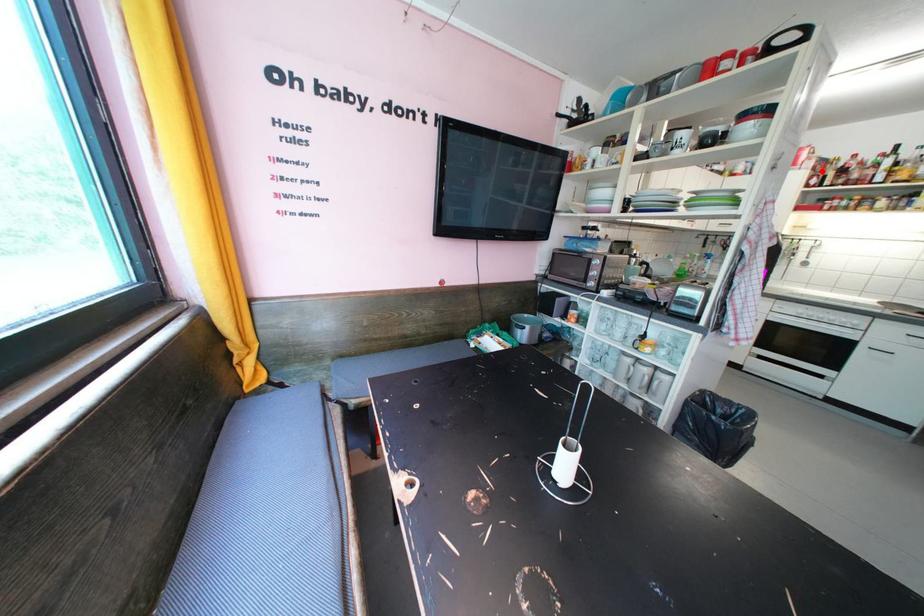
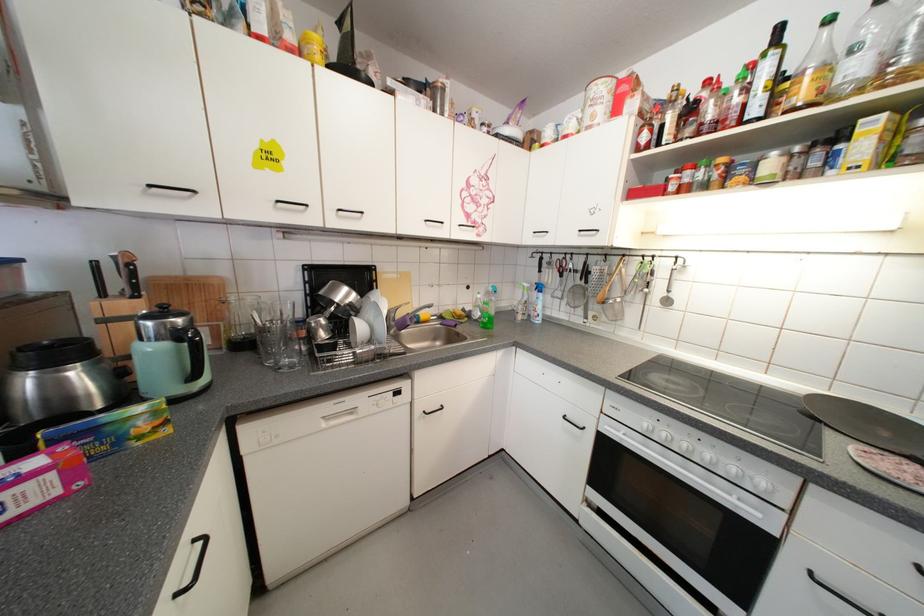
Find the pixel in the second image that matches the highlighted location in the first image.

(650, 116)